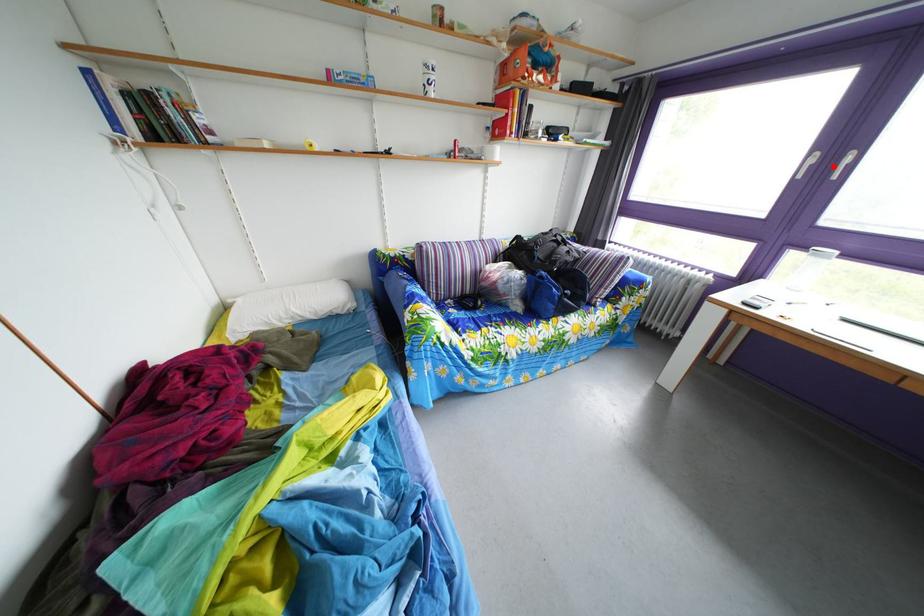
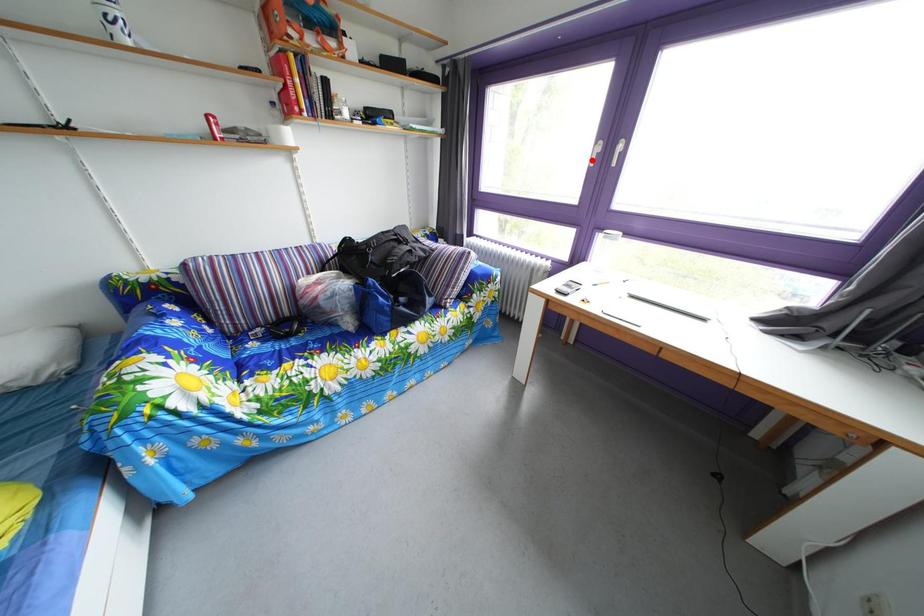
I am providing you with two images of the same scene from different viewpoints. A red point is marked on the first image and another point is marked on the second image. Are the points marked in image1 and image2 representing the same 3D position?

No